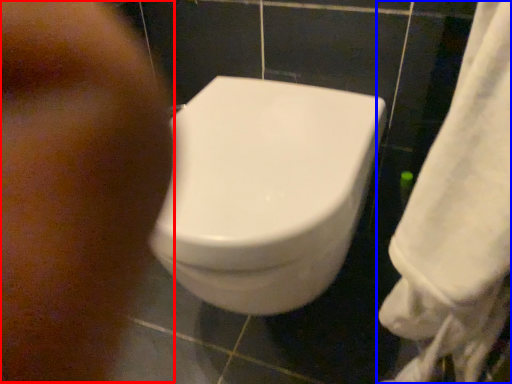
Question: Which of the following is the closest to the observer, face (highlighted by a red box) or towel (highlighted by a blue box)?

Choices:
 (A) face
 (B) towel

Answer: (B)